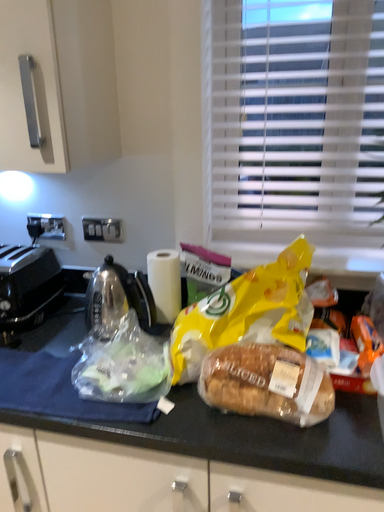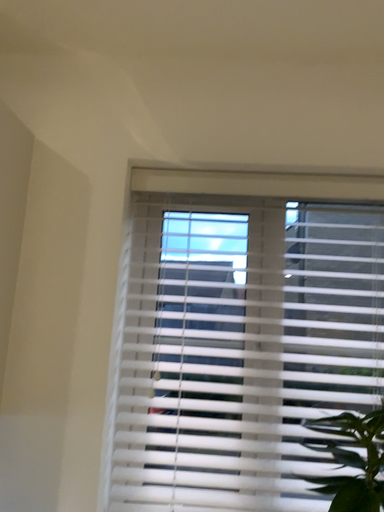
Question: How did the camera likely rotate when shooting the video?

Choices:
 (A) rotated upward
 (B) rotated downward

Answer: (A)